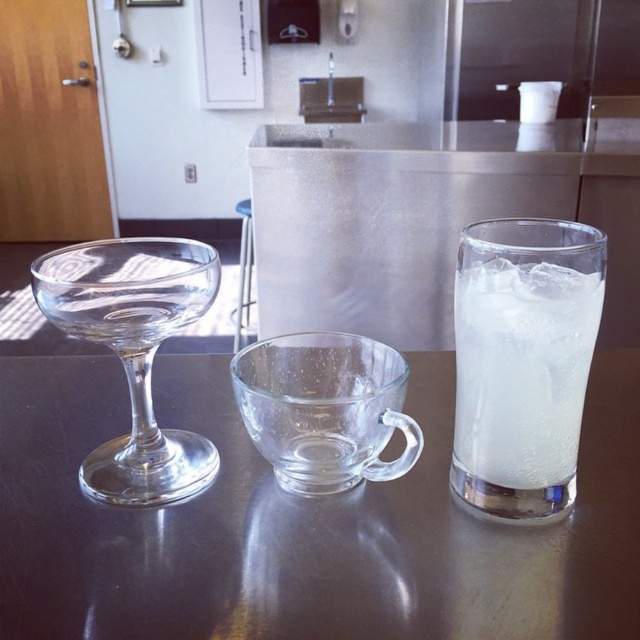
Question: Considering the real-world distances, which object is farthest from the transparent glass cup at center?

Choices:
 (A) clear glass at right
 (B) transparent glass wine glass at left

Answer: (B)

Question: Which of these objects is positioned closest to the clear glass at right?

Choices:
 (A) transparent glass cup at center
 (B) transparent glass table at center
 (C) transparent glass wine glass at left

Answer: (A)

Question: Can you confirm if transparent glass table at center is bigger than transparent glass wine glass at left?

Choices:
 (A) yes
 (B) no

Answer: (A)

Question: Among these points, which one is farthest from the camera?

Choices:
 (A) (372, 522)
 (B) (472, 445)

Answer: (A)

Question: Can you confirm if clear glass at right is thinner than transparent glass cup at center?

Choices:
 (A) no
 (B) yes

Answer: (B)

Question: Can you confirm if transparent glass table at center is wider than transparent glass wine glass at left?

Choices:
 (A) yes
 (B) no

Answer: (A)